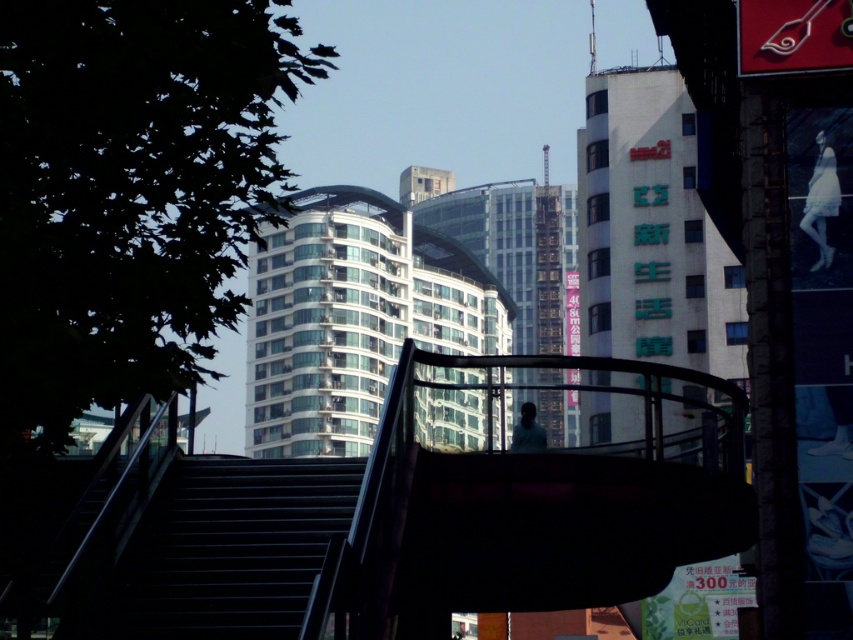
You are a photographer standing at the base of the dark staircase leading upwards. You want to take a photo that includes both the white lace dress at upper right and the light blue fabric person at center. Given that your camera has a maximum zoom range of 10 meters, can you capture both subjects in the same frame without moving your position?

The white lace dress at upper right and light blue fabric person at center are 15.82 meters apart, which exceeds the camera maximum zoom range of 10 meters. Therefore, you cannot capture both subjects in the same frame without moving your position.

You are a delivery person holding a package and need to climb the black metal stairs at center to reach the delivery point. The light blue fabric person at center is standing on the stairs. Do you think there is enough space for you to pass by them on the stairs?

The black metal stairs at center has a larger size compared to light blue fabric person at center, so there should be enough space for you to pass by the light blue fabric person at center on the stairs.

You are a photographer standing at the base of the black metal stairs at center. You want to take a photo of the white lace dress at upper right without any obstructions. Since the dress is smaller, will you need to move closer to frame it properly?

The black metal stairs at center is larger in size than the white lace dress at upper right, so you will need to move closer to the white lace dress at upper right to frame it properly since it is smaller and might be harder to capture in the shot.